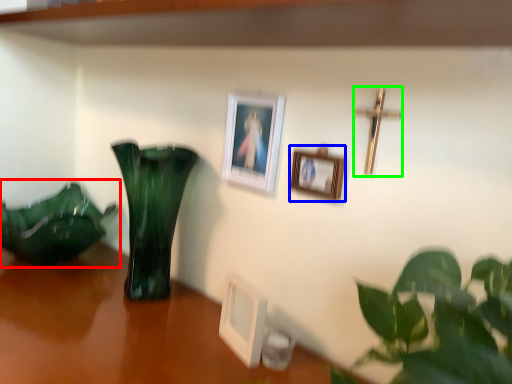
Question: Considering the real-world distances, which object is closest to houseplant (highlighted by a red box)? picture frame (highlighted by a blue box) or crucifix (highlighted by a green box).

Choices:
 (A) picture frame
 (B) crucifix

Answer: (A)